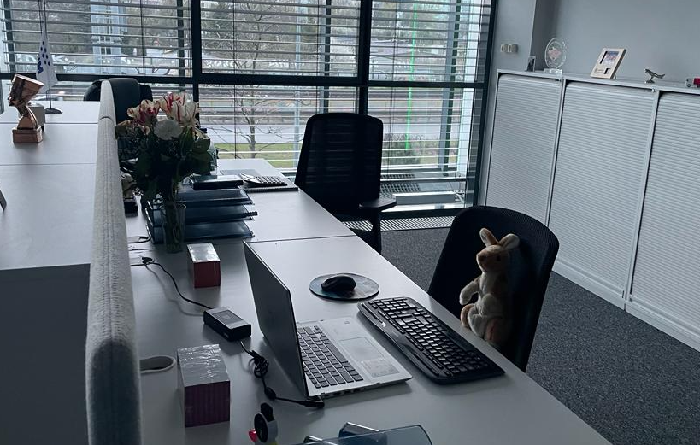
Where is `1 thermostat`? The width and height of the screenshot is (700, 445). 1 thermostat is located at coordinates pos(510,49).